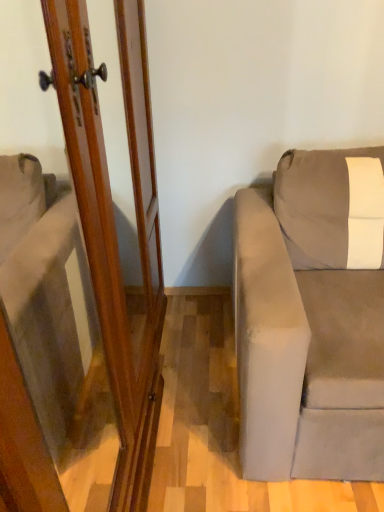
Question: Does wooden screen door at left have a smaller size compared to gray suede couch at right?

Choices:
 (A) yes
 (B) no

Answer: (B)

Question: Is the depth of wooden screen door at left less than that of gray suede couch at right?

Choices:
 (A) no
 (B) yes

Answer: (B)

Question: Can you confirm if wooden screen door at left is shorter than gray suede couch at right?

Choices:
 (A) yes
 (B) no

Answer: (B)

Question: Are wooden screen door at left and gray suede couch at right far apart?

Choices:
 (A) yes
 (B) no

Answer: (B)

Question: Considering the relative positions of wooden screen door at left and gray suede couch at right in the image provided, is wooden screen door at left to the left of gray suede couch at right from the viewer's perspective?

Choices:
 (A) no
 (B) yes

Answer: (B)

Question: Is wooden screen door at left located outside gray suede couch at right?

Choices:
 (A) yes
 (B) no

Answer: (A)

Question: From a real-world perspective, is gray suede couch at right on wooden screen door at left?

Choices:
 (A) no
 (B) yes

Answer: (A)

Question: Considering the relative positions of gray suede couch at right and wooden screen door at left in the image provided, is gray suede couch at right in front of wooden screen door at left?

Choices:
 (A) yes
 (B) no

Answer: (B)

Question: Does gray suede couch at right have a smaller size compared to wooden screen door at left?

Choices:
 (A) no
 (B) yes

Answer: (B)

Question: Is gray suede couch at right not near wooden screen door at left?

Choices:
 (A) no
 (B) yes

Answer: (A)

Question: Would you say gray suede couch at right is outside wooden screen door at left?

Choices:
 (A) no
 (B) yes

Answer: (B)

Question: Does gray suede couch at right have a lesser height compared to wooden screen door at left?

Choices:
 (A) yes
 (B) no

Answer: (A)

Question: Considering the positions of gray suede couch at right and wooden screen door at left in the image, is gray suede couch at right wider or thinner than wooden screen door at left?

Choices:
 (A) thin
 (B) wide

Answer: (B)